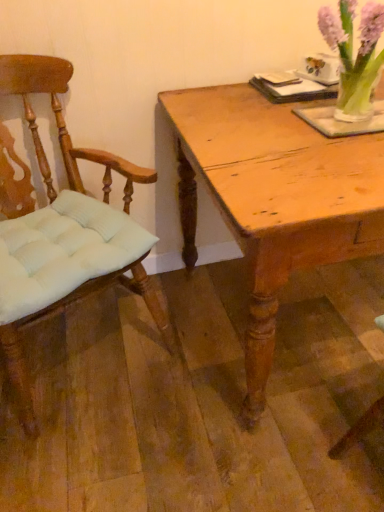
Question: Can you confirm if light brown wood chair at left is positioned to the right of light brown wooden table at center?

Choices:
 (A) no
 (B) yes

Answer: (A)

Question: Is light brown wood chair at left not within light brown wooden table at center?

Choices:
 (A) no
 (B) yes

Answer: (B)

Question: Can you confirm if light brown wood chair at left is smaller than light brown wooden table at center?

Choices:
 (A) no
 (B) yes

Answer: (B)

Question: From the image's perspective, would you say light brown wood chair at left is shown under light brown wooden table at center?

Choices:
 (A) no
 (B) yes

Answer: (B)

Question: From a real-world perspective, is light brown wood chair at left on light brown wooden table at center?

Choices:
 (A) yes
 (B) no

Answer: (A)

Question: Is light brown wooden table at center surrounded by light brown wood chair at left?

Choices:
 (A) yes
 (B) no

Answer: (B)

Question: Could you tell me if light brown wooden table at center is facing light brown wood chair at left?

Choices:
 (A) no
 (B) yes

Answer: (A)

Question: Is light brown wooden table at center to the left of light brown wood chair at left from the viewer's perspective?

Choices:
 (A) no
 (B) yes

Answer: (A)

Question: Can you confirm if light brown wooden table at center is bigger than light brown wood chair at left?

Choices:
 (A) no
 (B) yes

Answer: (B)

Question: Considering the relative sizes of light brown wooden table at center and light brown wood chair at left in the image provided, is light brown wooden table at center thinner than light brown wood chair at left?

Choices:
 (A) no
 (B) yes

Answer: (A)

Question: Could light brown wood chair at left be considered to be inside light brown wooden table at center?

Choices:
 (A) yes
 (B) no

Answer: (B)

Question: Does light brown wooden table at center have a lesser height compared to light brown wood chair at left?

Choices:
 (A) no
 (B) yes

Answer: (B)

Question: Is the position of light brown wooden table at center more distant than that of translucent glass vase at upper right?

Choices:
 (A) yes
 (B) no

Answer: (B)